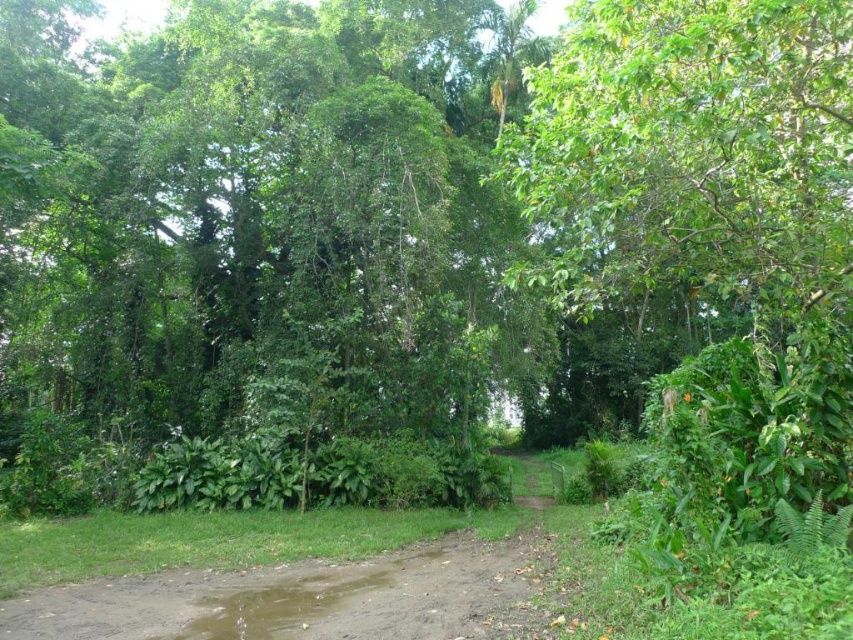
From the picture: You are a hiker trying to navigate through the jungle. You see a green leafy tree at center and a brown dirt track at center. Which one is wider from your perspective?

The green leafy tree at center might be wider than brown dirt track at center, so the green leafy tree at center is wider.

You are a hiker trying to navigate through the jungle. You see the green leafy tree at center and the brown dirt track at center. Which object is higher from the ground?

The green leafy tree at center is above the brown dirt track at center, so the green leafy tree at center is higher from the ground.